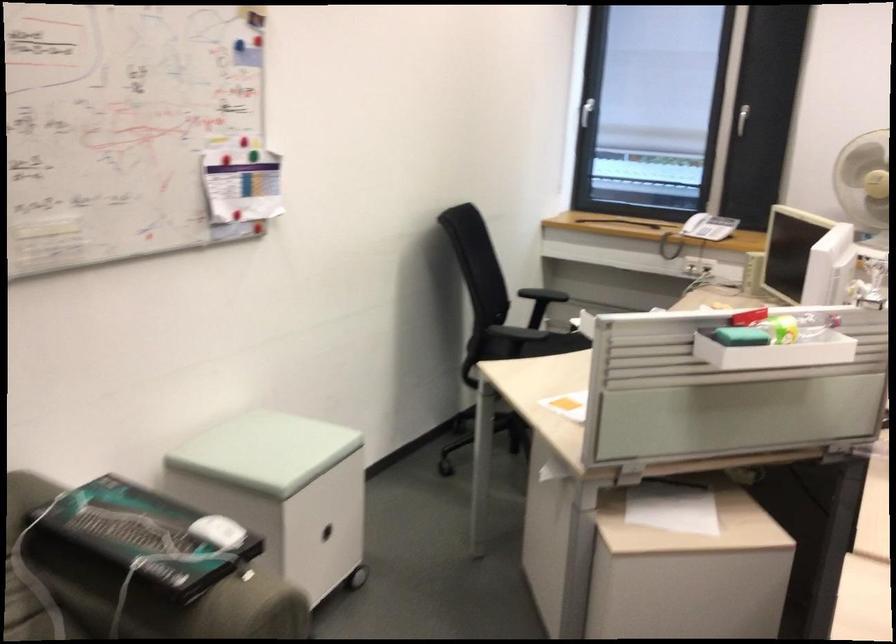
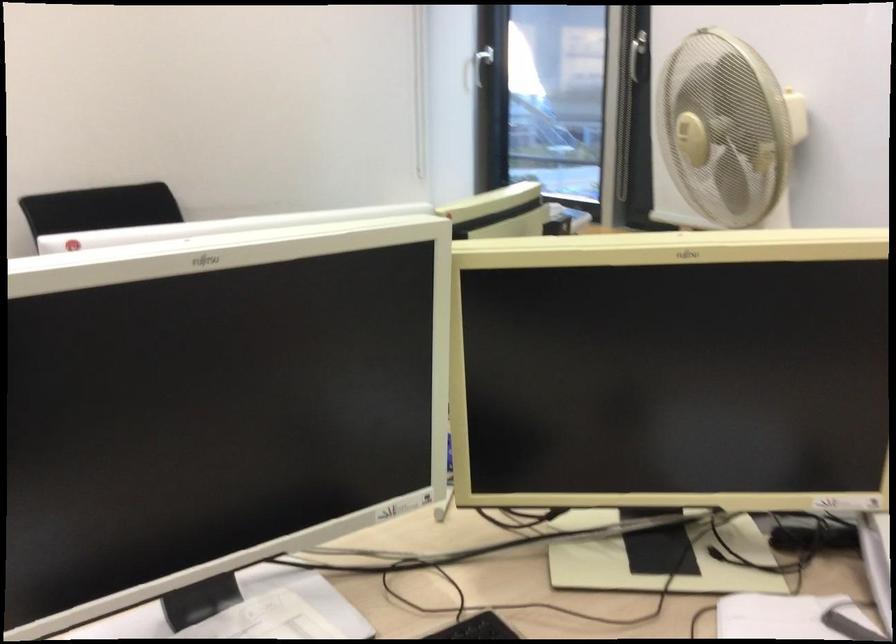
In a continuous first-person perspective shot, in which direction is the camera moving?

The cameraman moved toward right, forward.